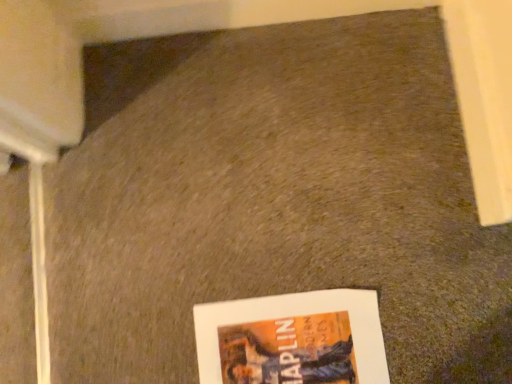
Image resolution: width=512 pixels, height=384 pixels. I want to click on matte paper picture frame at lower center, so click(x=292, y=339).

This screenshot has width=512, height=384. What do you see at coordinates (292, 339) in the screenshot?
I see `matte paper picture frame at lower center` at bounding box center [292, 339].

This screenshot has width=512, height=384. Identify the location of matte paper picture frame at lower center. (292, 339).